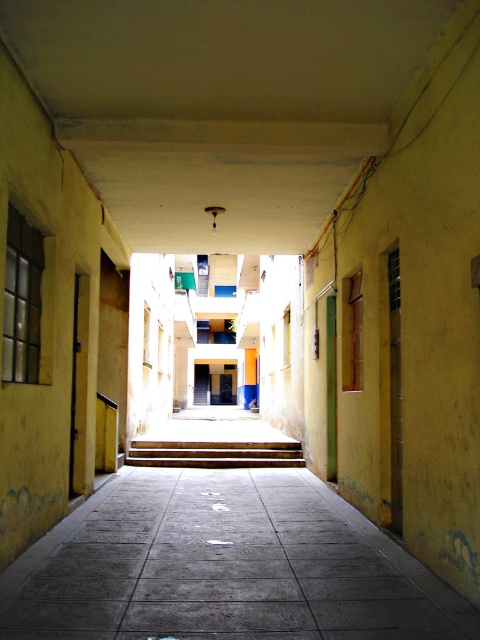
Question: Which point is closer to the camera?

Choices:
 (A) wooden stairs at center
 (B) gray concrete pavement at center

Answer: (B)

Question: Is gray concrete pavement at center wider than wooden stairs at center?

Choices:
 (A) yes
 (B) no

Answer: (B)

Question: Can you confirm if gray concrete pavement at center is thinner than wooden stairs at center?

Choices:
 (A) yes
 (B) no

Answer: (A)

Question: Can you confirm if gray concrete pavement at center is positioned below wooden stairs at center?

Choices:
 (A) no
 (B) yes

Answer: (A)

Question: Which of the following is the closest to the observer?

Choices:
 (A) gray concrete pavement at center
 (B) wooden stairs at center

Answer: (A)